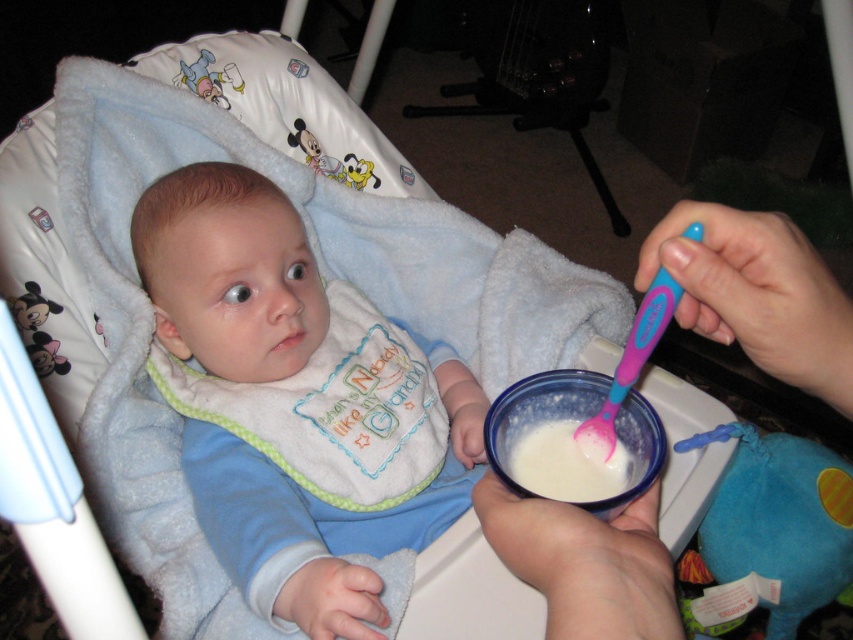
Question: From the image, what is the correct spatial relationship of blue soft bib at center in relation to white plastic bowl at lower center?

Choices:
 (A) right
 (B) left

Answer: (B)

Question: In this image, where is white plastic bowl at lower center located relative to pink plastic spoon at upper center?

Choices:
 (A) below
 (B) above

Answer: (A)

Question: Which object is positioned closest to the white plastic bowl at lower center?

Choices:
 (A) pink plastic spoon at upper center
 (B) blue soft bib at center
 (C) blue plush toy at lower right

Answer: (A)

Question: Which object appears farthest from the camera in this image?

Choices:
 (A) blue plush toy at lower right
 (B) pink plastic spoon at upper center
 (C) white plastic bowl at lower center

Answer: (A)

Question: Which object appears closest to the camera in this image?

Choices:
 (A) blue plush toy at lower right
 (B) pink plastic spoon at upper center

Answer: (B)

Question: Does blue soft bib at center lie behind blue plush toy at lower right?

Choices:
 (A) yes
 (B) no

Answer: (B)